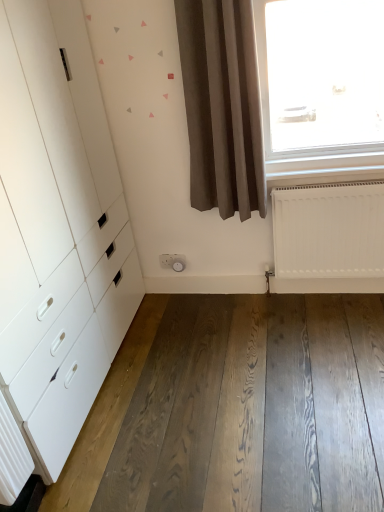
Find the location of a particular element. The height and width of the screenshot is (512, 384). vacant space situated above dark brown wood flooring at lower center (from a real-world perspective) is located at coordinates (238, 382).